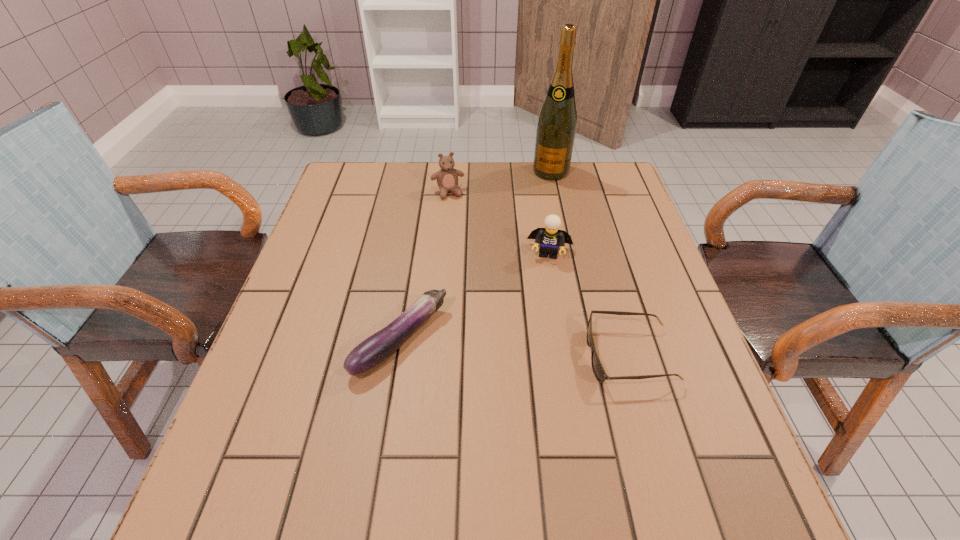
Locate an element on the screen. This screenshot has height=540, width=960. vacant point located on the front-facing side of the teddy bear is located at coordinates (475, 276).

This screenshot has width=960, height=540. Find the location of `free space located on the front-facing side of the teddy bear`. free space located on the front-facing side of the teddy bear is located at coordinates coord(455,214).

Identify the location of vacant point located 0.140m on the front-facing side of the teddy bear. (460, 230).

The width and height of the screenshot is (960, 540). I want to click on vacant area located on the front-facing side of the wine bottle, so click(x=539, y=205).

This screenshot has width=960, height=540. Find the location of `vacant space situated 0.320m on the front-facing side of the wine bottle`. vacant space situated 0.320m on the front-facing side of the wine bottle is located at coordinates (523, 246).

Where is `free space located 0.120m on the front-facing side of the wine bottle`? This screenshot has width=960, height=540. free space located 0.120m on the front-facing side of the wine bottle is located at coordinates (540, 202).

Find the location of a particular element. vacant area situated on the front-facing side of the third nearest object is located at coordinates (535, 364).

The image size is (960, 540). Find the location of `vacant space located on the front-facing side of the third nearest object`. vacant space located on the front-facing side of the third nearest object is located at coordinates (545, 281).

Where is `vacant space located 0.150m on the front-facing side of the third nearest object`? vacant space located 0.150m on the front-facing side of the third nearest object is located at coordinates (541, 309).

The width and height of the screenshot is (960, 540). Identify the location of teddy bear that is positioned at the far edge. click(x=447, y=177).